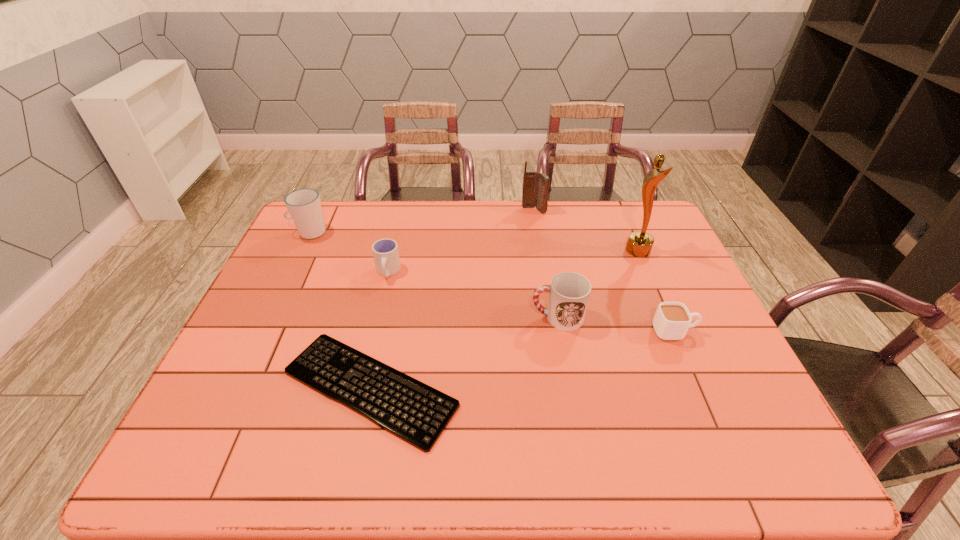
What are the coordinates of `object at the far left corner` in the screenshot? It's located at (304, 206).

Where is `object present at the near left corner`? The height and width of the screenshot is (540, 960). object present at the near left corner is located at coordinates (413, 411).

Locate an element on the screen. Image resolution: width=960 pixels, height=540 pixels. object present at the far right corner is located at coordinates (639, 244).

This screenshot has width=960, height=540. In order to click on free space at the far edge of the desktop in this screenshot , I will do `click(599, 206)`.

Where is `free region at the near edge of the desktop`? free region at the near edge of the desktop is located at coordinates (282, 453).

In the image, there is a desktop. Where is `free region at the left edge`? The height and width of the screenshot is (540, 960). free region at the left edge is located at coordinates (252, 402).

Identify the location of vacant space at the right edge of the desktop. Image resolution: width=960 pixels, height=540 pixels. (752, 423).

At what (x,y) coordinates should I click in order to perform the action: click on vacant space at the far right corner. Please return your answer as a coordinate pair (x, y). The width and height of the screenshot is (960, 540). Looking at the image, I should click on (621, 210).

Where is `free space that is in between the shortest object and the tallest object`? Image resolution: width=960 pixels, height=540 pixels. free space that is in between the shortest object and the tallest object is located at coordinates (x=504, y=319).

This screenshot has height=540, width=960. In order to click on vacant area that lies between the sixth tallest object and the award in this screenshot , I will do `click(657, 291)`.